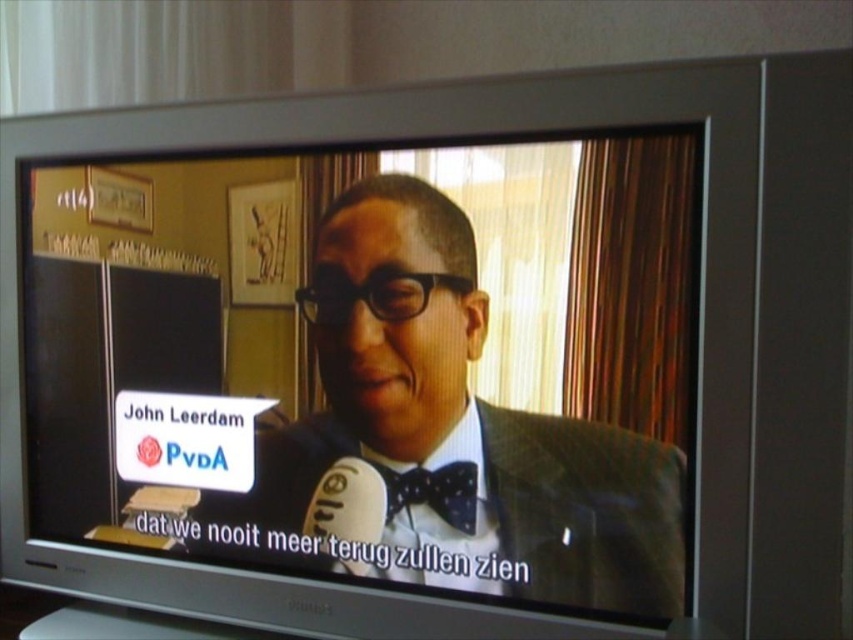
Question: Which of the following is the closest to the observer?

Choices:
 (A) polished dark suit at center
 (B) black dotted bow tie at center

Answer: (A)

Question: Considering the relative positions of polished dark suit at center and black dotted bow tie at center in the image provided, where is polished dark suit at center located with respect to black dotted bow tie at center?

Choices:
 (A) below
 (B) above

Answer: (B)

Question: Does polished dark suit at center have a smaller size compared to black dotted bow tie at center?

Choices:
 (A) no
 (B) yes

Answer: (A)

Question: Can you confirm if polished dark suit at center is positioned to the right of black dotted bow tie at center?

Choices:
 (A) no
 (B) yes

Answer: (B)

Question: Which of the following is the farthest from the observer?

Choices:
 (A) black dotted bow tie at center
 (B) polished dark suit at center

Answer: (A)

Question: Which point is closer to the camera taking this photo?

Choices:
 (A) (384, 449)
 (B) (463, 506)

Answer: (B)